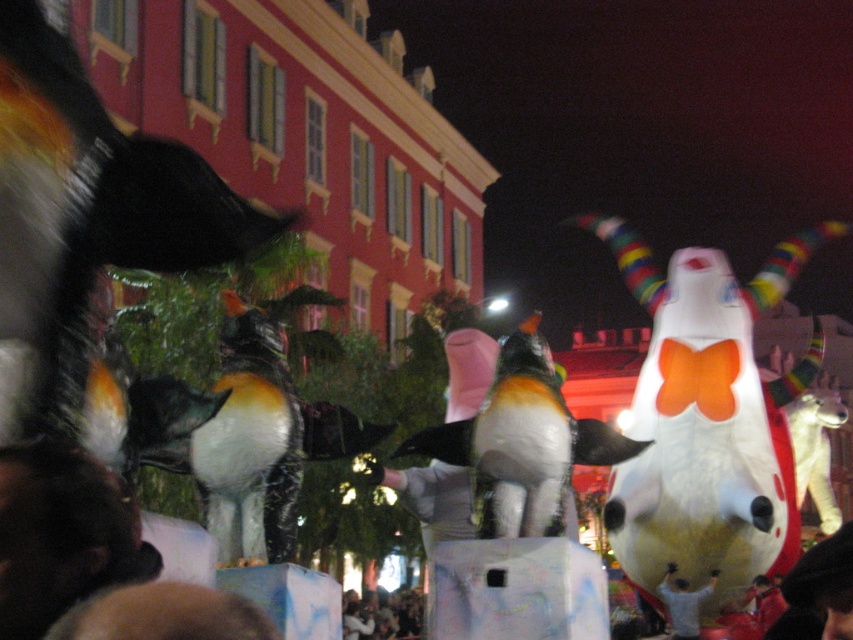
Question: Can you confirm if orange and white plush penguin at center is bigger than smooth skin crowd at lower center?

Choices:
 (A) no
 (B) yes

Answer: (A)

Question: Which of the following is the farthest from the observer?

Choices:
 (A) (779, 260)
 (B) (386, 602)
 (C) (10, 544)
 (D) (589, 420)

Answer: (B)

Question: Is white glossy horned bull at center to the left of dark hair at lower left from the viewer's perspective?

Choices:
 (A) no
 (B) yes

Answer: (A)

Question: Among these objects, which one is nearest to the camera?

Choices:
 (A) orange and white plush penguin at center
 (B) white glossy horned bull at center
 (C) smooth white shirt at center
 (D) dark hair at lower left

Answer: (D)

Question: Which of the following is the farthest from the observer?

Choices:
 (A) orange and white plush penguin at center
 (B) smooth white shirt at center
 (C) smooth skin crowd at lower center

Answer: (C)

Question: Can you confirm if white glossy horned bull at center is positioned below smooth white shirt at center?

Choices:
 (A) yes
 (B) no

Answer: (B)